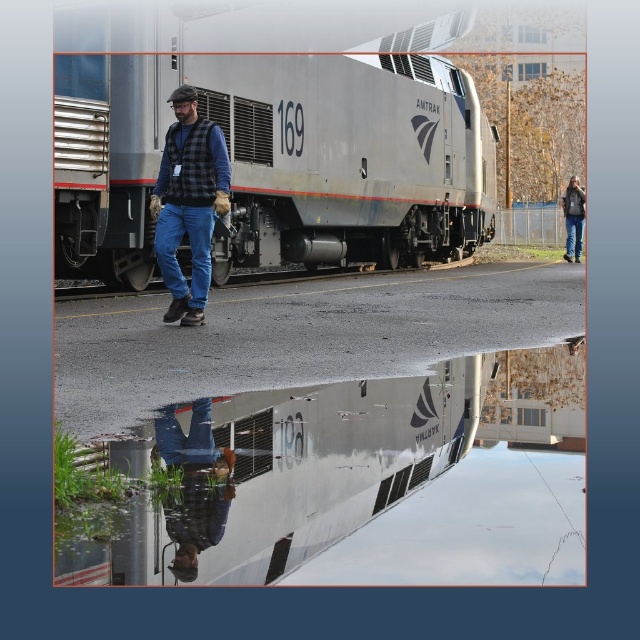
Question: Estimate the real-world distances between objects in this image. Which object is farther from the blue jeans at lower left?

Choices:
 (A) brushed metal train at center
 (B) denim jacket at upper right
 (C) plaid vest at center

Answer: (B)

Question: Can you confirm if blue jeans at lower left is positioned below denim jacket at upper right?

Choices:
 (A) no
 (B) yes

Answer: (B)

Question: Which of these objects is positioned closest to the brushed metal train at center?

Choices:
 (A) plaid vest at center
 (B) denim jacket at upper right
 (C) blue jeans at lower left

Answer: (A)

Question: Estimate the real-world distances between objects in this image. Which object is farther from the plaid vest at center?

Choices:
 (A) denim jacket at upper right
 (B) brushed metal train at center
 (C) blue jeans at lower left

Answer: (A)

Question: Does brushed metal train at center have a smaller size compared to blue jeans at lower left?

Choices:
 (A) yes
 (B) no

Answer: (B)

Question: Is plaid vest at center behind blue jeans at lower left?

Choices:
 (A) yes
 (B) no

Answer: (A)